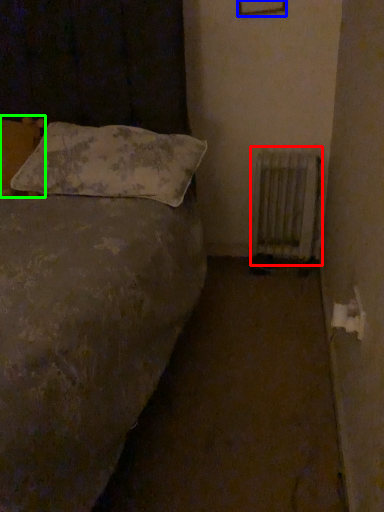
Question: Which object is positioned closest to radiator (highlighted by a red box)? Select from picture frame (highlighted by a blue box) and pillow (highlighted by a green box).

Choices:
 (A) picture frame
 (B) pillow

Answer: (A)